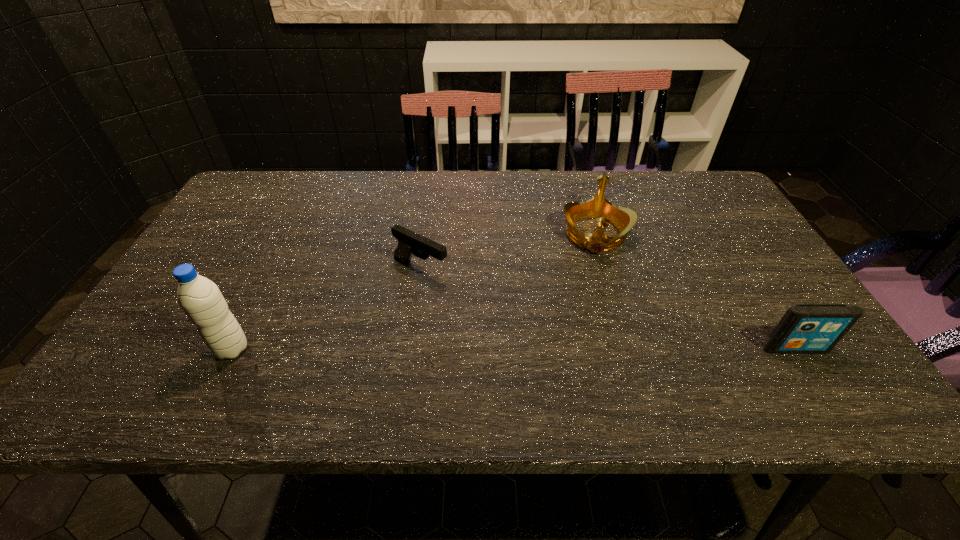
Identify the location of free space on the desktop that is between the water bottle and the iPod and is positioned at the front emblem of the tiara. (592, 349).

The height and width of the screenshot is (540, 960). I want to click on free spot on the desktop that is between the tallest object and the iPod and is positioned on the front-facing side of the pistol, so click(x=574, y=349).